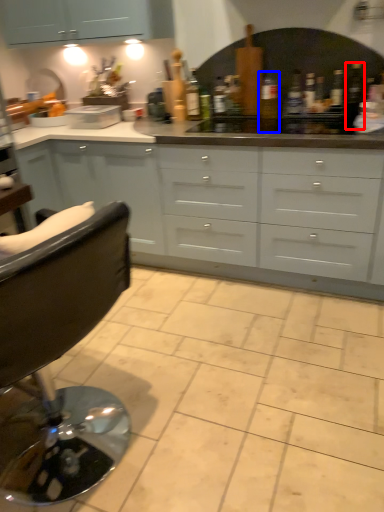
Question: Which of the following is the farthest to the observer, bottle (highlighted by a red box) or bottle (highlighted by a blue box)?

Choices:
 (A) bottle
 (B) bottle

Answer: (B)